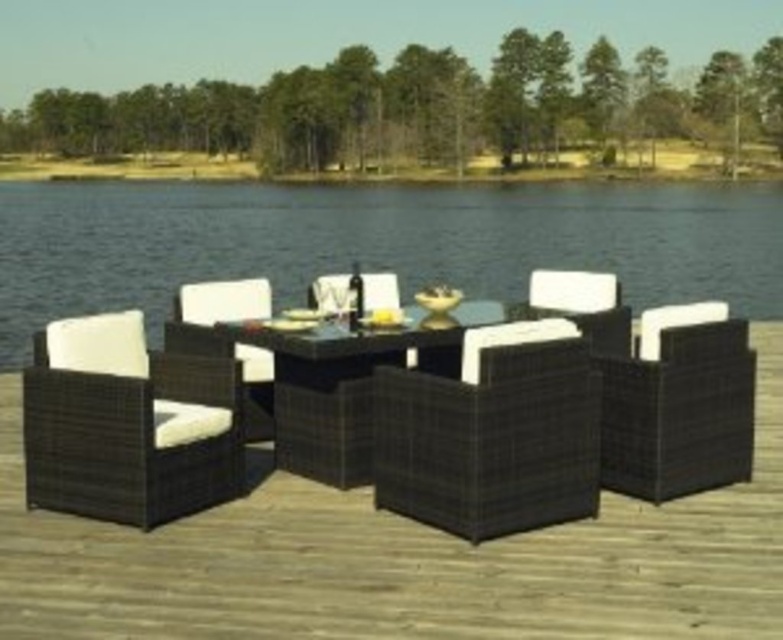
Between black wicker table at center and matte wicker armchair at left, which one appears on the right side from the viewer's perspective?

From the viewer's perspective, black wicker table at center appears more on the right side.

Does black wicker table at center have a greater height compared to matte wicker armchair at left?

Yes.

What do you see at coordinates (345, 387) in the screenshot?
I see `black wicker table at center` at bounding box center [345, 387].

Locate an element on the screen. black wicker table at center is located at coordinates pyautogui.click(x=345, y=387).

Who is positioned more to the left, blue water at center or black wicker armchair at right?

blue water at center is more to the left.

Based on the photo, between blue water at center and black wicker armchair at right, which one has more height?

blue water at center is taller.

Is point (536, 227) closer to camera compared to point (695, 349)?

No, it is not.

The width and height of the screenshot is (783, 640). What are the coordinates of `blue water at center` in the screenshot? It's located at (376, 243).

Does blue water at center come behind black wicker armchair at left?

Yes, it is behind black wicker armchair at left.

Who is more distant from viewer, (345,257) or (31,371)?

Point (345,257)

Where is `blue water at center`? This screenshot has width=783, height=640. blue water at center is located at coordinates (376, 243).